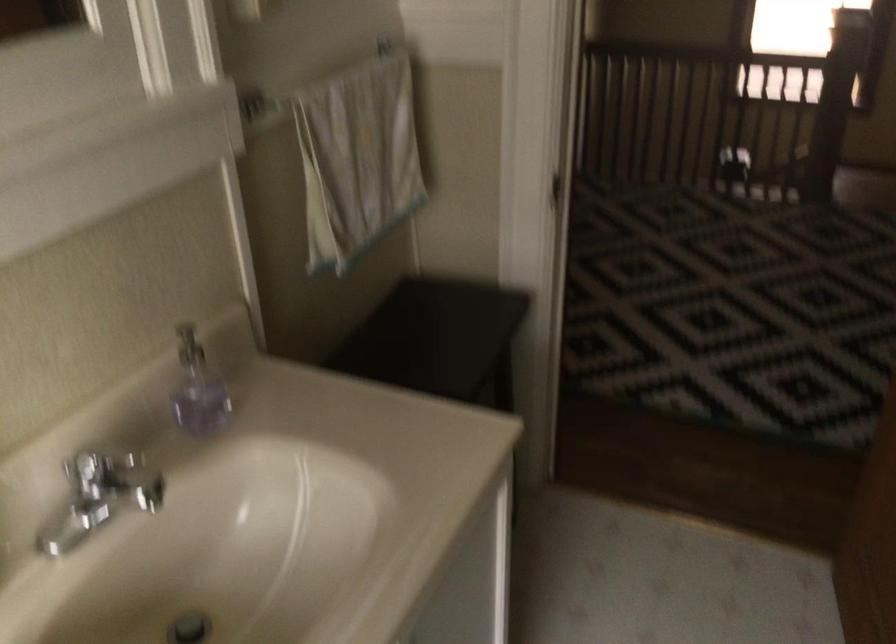
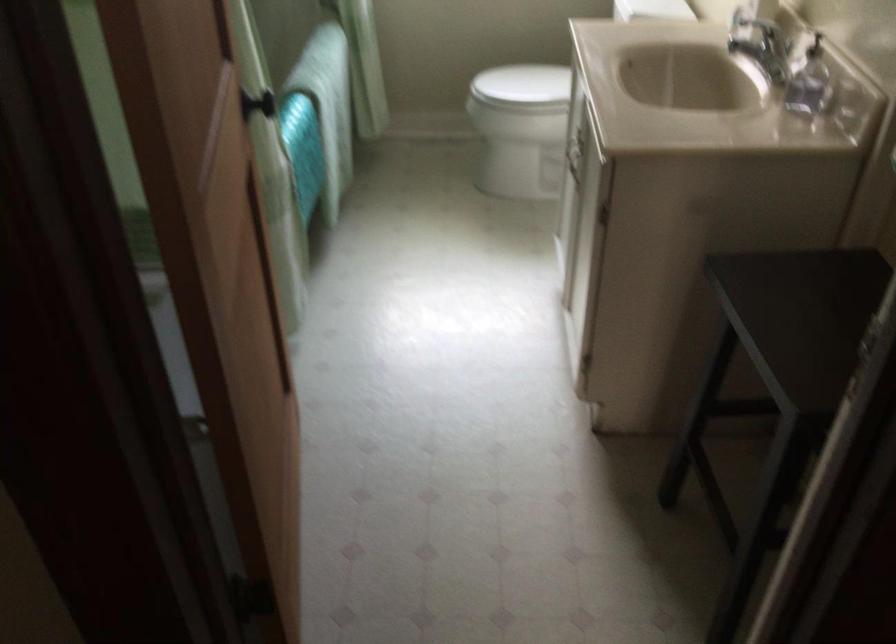
Find the pixel in the second image that matches (444,348) in the first image.

(798, 317)